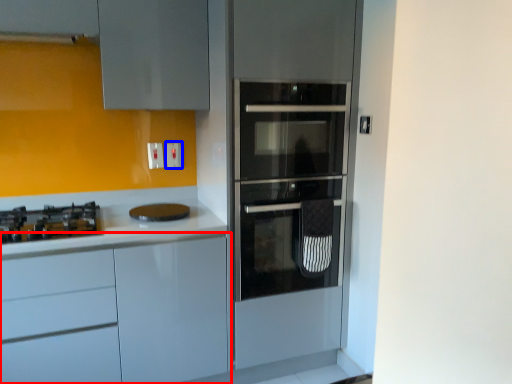
Question: Which object is further to the camera taking this photo, cabinetry (highlighted by a red box) or electric outlet (highlighted by a blue box)?

Choices:
 (A) cabinetry
 (B) electric outlet

Answer: (B)